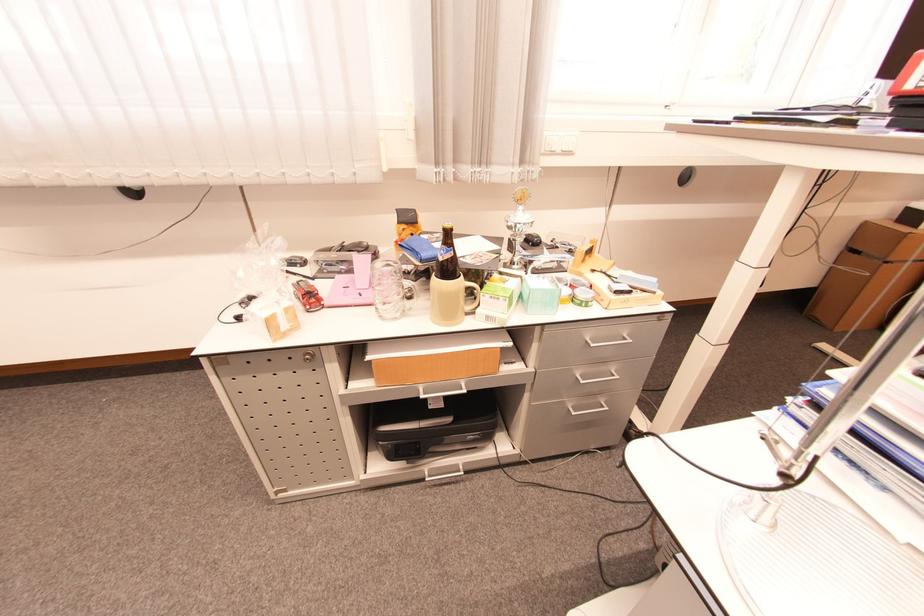
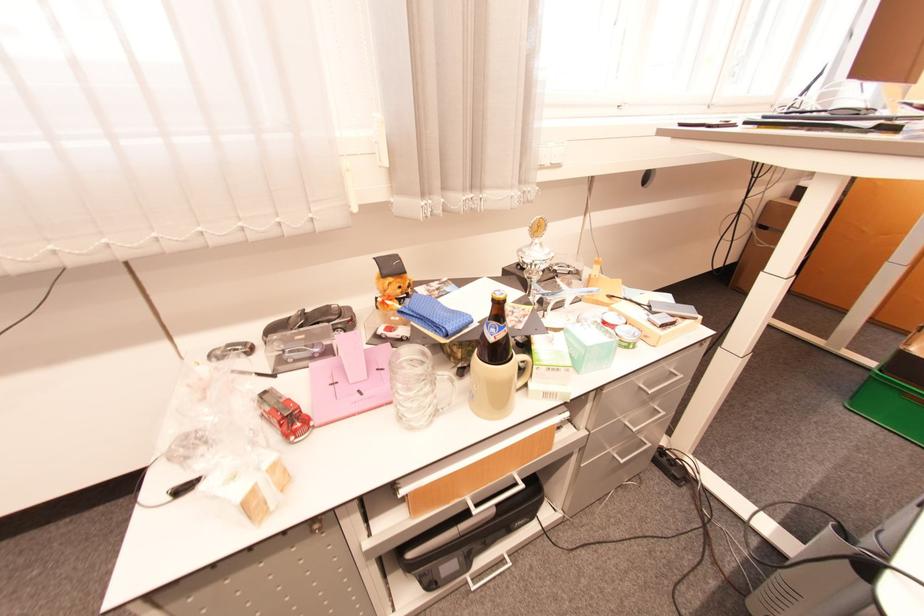
What movement of the cameraman would produce the second image?

The cameraman moved toward left, forward.